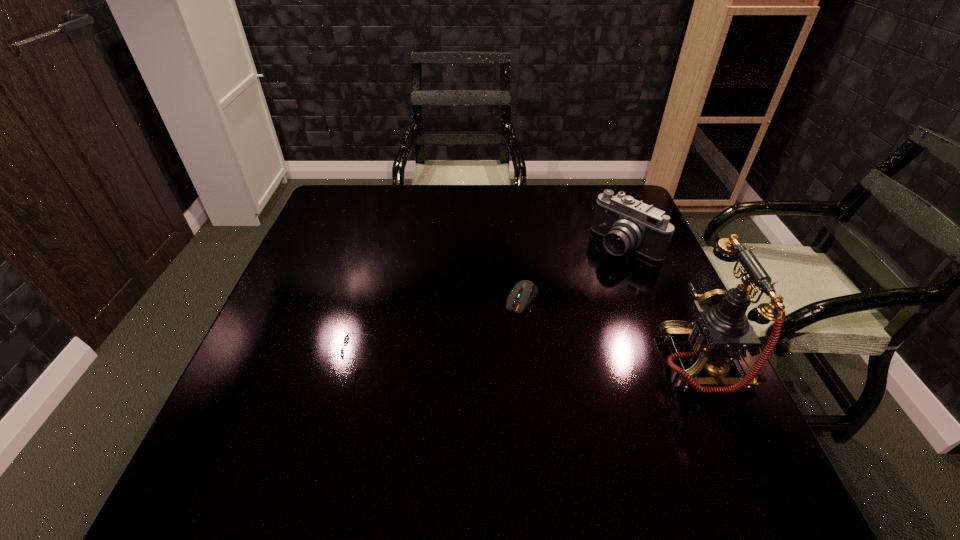
You are a GUI agent. You are given a task and a screenshot of the screen. Output one action in this format:
    pyautogui.click(x=<x>, y=<y>)
    Task: Click on the empty space between the shortest object and the sunglasses
    Image resolution: width=960 pixels, height=540 pixels.
    Given the screenshot: What is the action you would take?
    pyautogui.click(x=443, y=332)

The width and height of the screenshot is (960, 540). Identify the location of vacant point located between the second tallest object and the leftmost object. (495, 304).

The image size is (960, 540). Identify the location of free point between the leftmost object and the farthest object. (495, 304).

This screenshot has height=540, width=960. What are the coordinates of `free space between the second tallest object and the second object from left to right` in the screenshot? It's located at (574, 272).

Locate an element on the screen. This screenshot has height=540, width=960. vacant area that lies between the telephone and the shortest object is located at coordinates (613, 330).

Where is `free space between the camera and the second shortest object`? Image resolution: width=960 pixels, height=540 pixels. free space between the camera and the second shortest object is located at coordinates (495, 304).

The image size is (960, 540). I want to click on the closest object to the third tallest object, so click(x=523, y=292).

Image resolution: width=960 pixels, height=540 pixels. Identify the location of object that stands as the second closest to the sunglasses. (627, 224).

Locate an element on the screen. The image size is (960, 540). free space that satisfies the following two spatial constraints: 1. on the front side of the telephone; 2. on the front of the second object from left to right, featuring the rotary dial is located at coordinates (528, 362).

Identify the location of free spot that satisfies the following two spatial constraints: 1. on the back side of the third nearest object; 2. on the right side of the third shortest object. The height and width of the screenshot is (540, 960). (516, 245).